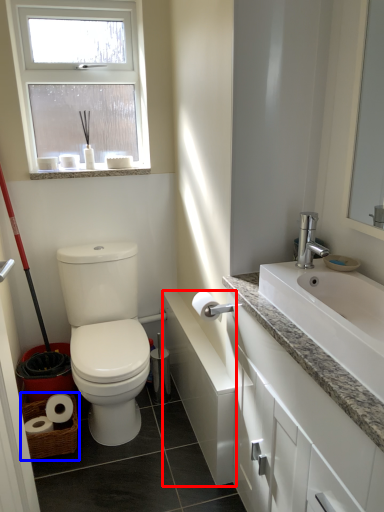
Question: Which of the following is the closest to the observer, bath (highlighted by a red box) or basket (highlighted by a blue box)?

Choices:
 (A) bath
 (B) basket

Answer: (A)